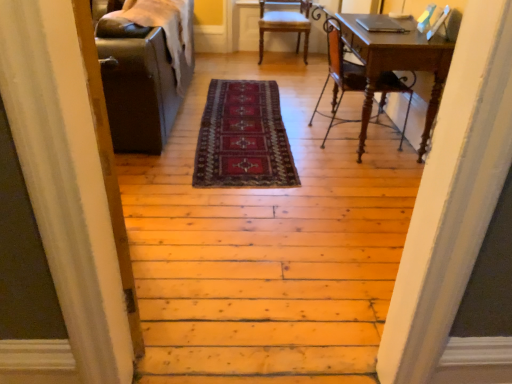
Locate an element on the screen. This screenshot has height=384, width=512. free space in front of wooden chair at right, the 1th chair positioned from the bottom is located at coordinates (352, 168).